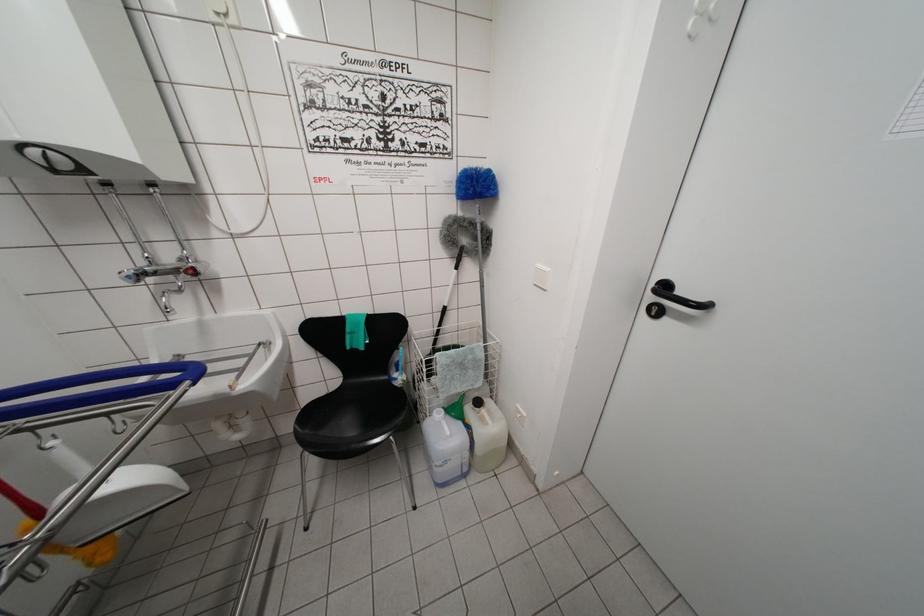
This screenshot has height=616, width=924. I want to click on black door handle, so click(x=672, y=300).